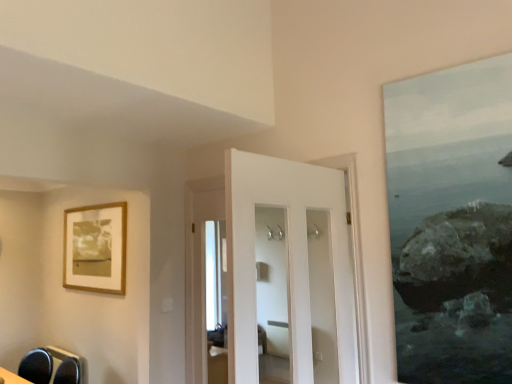
Question: Should I look upward or downward to see matte black swivel chair at lower left?

Choices:
 (A) down
 (B) up

Answer: (A)

Question: Can you confirm if white glossy door at center is taller than matte black swivel chair at lower left?

Choices:
 (A) yes
 (B) no

Answer: (A)

Question: From the image's perspective, would you say white glossy door at center is shown under matte black swivel chair at lower left?

Choices:
 (A) yes
 (B) no

Answer: (B)

Question: Is white glossy door at center not close to matte black swivel chair at lower left?

Choices:
 (A) yes
 (B) no

Answer: (A)

Question: From the image's perspective, is white glossy door at center above matte black swivel chair at lower left?

Choices:
 (A) no
 (B) yes

Answer: (B)

Question: Is white glossy door at center completely or partially outside of matte black swivel chair at lower left?

Choices:
 (A) no
 (B) yes

Answer: (B)

Question: Is white glossy door at center bigger than matte black swivel chair at lower left?

Choices:
 (A) yes
 (B) no

Answer: (A)

Question: From a real-world perspective, does wooden frame at upper left sit lower than matte black swivel chair at lower left?

Choices:
 (A) yes
 (B) no

Answer: (B)

Question: Considering the relative sizes of wooden frame at upper left and matte black swivel chair at lower left in the image provided, is wooden frame at upper left wider than matte black swivel chair at lower left?

Choices:
 (A) no
 (B) yes

Answer: (A)

Question: Considering the relative sizes of wooden frame at upper left and matte black swivel chair at lower left in the image provided, is wooden frame at upper left thinner than matte black swivel chair at lower left?

Choices:
 (A) no
 (B) yes

Answer: (B)

Question: Considering the relative sizes of wooden frame at upper left and matte black swivel chair at lower left in the image provided, is wooden frame at upper left shorter than matte black swivel chair at lower left?

Choices:
 (A) yes
 (B) no

Answer: (B)

Question: Can you confirm if wooden frame at upper left is bigger than matte black swivel chair at lower left?

Choices:
 (A) yes
 (B) no

Answer: (B)

Question: Is wooden frame at upper left positioned with its back to matte black swivel chair at lower left?

Choices:
 (A) no
 (B) yes

Answer: (A)

Question: From the image's perspective, is matte black swivel chair at lower left on white glossy door at center?

Choices:
 (A) yes
 (B) no

Answer: (B)